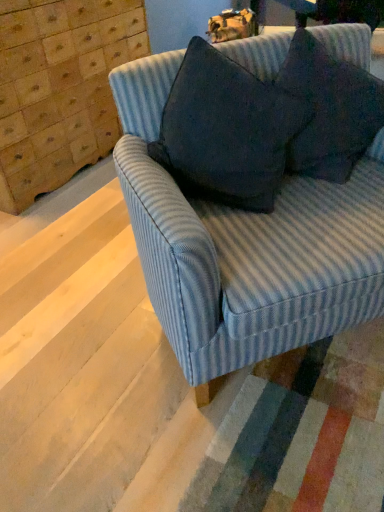
Question: Does dark fabric pillow at upper right, which is counted as the 1th throw pillow, starting from the right, have a lesser height compared to dark gray fabric pillow at upper right, arranged as the second throw pillow when viewed from the right?

Choices:
 (A) yes
 (B) no

Answer: (A)

Question: Does dark fabric pillow at upper right, which is counted as the second throw pillow, starting from the left, have a lesser width compared to dark gray fabric pillow at upper right, arranged as the second throw pillow when viewed from the right?

Choices:
 (A) no
 (B) yes

Answer: (B)

Question: Is dark fabric pillow at upper right, which is counted as the 1th throw pillow, starting from the right, facing away from dark gray fabric pillow at upper right, the first throw pillow when ordered from left to right?

Choices:
 (A) yes
 (B) no

Answer: (B)

Question: From the image's perspective, would you say dark fabric pillow at upper right, which is counted as the 1th throw pillow, starting from the right, is positioned over dark gray fabric pillow at upper right, the first throw pillow when ordered from left to right?

Choices:
 (A) no
 (B) yes

Answer: (B)

Question: Is dark fabric pillow at upper right, which is counted as the 1th throw pillow, starting from the right, in contact with dark gray fabric pillow at upper right, arranged as the second throw pillow when viewed from the right?

Choices:
 (A) yes
 (B) no

Answer: (B)

Question: In the image, is blue striped fabric couch at center on the left side or the right side of wooden dresser at upper left?

Choices:
 (A) right
 (B) left

Answer: (A)

Question: Is blue striped fabric couch at center taller or shorter than wooden dresser at upper left?

Choices:
 (A) tall
 (B) short

Answer: (B)

Question: Does point (196, 337) appear closer or farther from the camera than point (11, 209)?

Choices:
 (A) farther
 (B) closer

Answer: (B)

Question: Is blue striped fabric couch at center inside or outside of wooden dresser at upper left?

Choices:
 (A) inside
 (B) outside

Answer: (B)

Question: Based on their positions, is wooden dresser at upper left located to the left or right of dark fabric pillow at upper right, which is counted as the 1th throw pillow, starting from the right?

Choices:
 (A) left
 (B) right

Answer: (A)

Question: Is wooden dresser at upper left in front of or behind dark fabric pillow at upper right, which is counted as the 1th throw pillow, starting from the right, in the image?

Choices:
 (A) front
 (B) behind

Answer: (B)

Question: From the image's perspective, relative to dark fabric pillow at upper right, which is counted as the 1th throw pillow, starting from the right, is wooden dresser at upper left above or below?

Choices:
 (A) below
 (B) above

Answer: (B)

Question: From a real-world perspective, relative to dark fabric pillow at upper right, which is counted as the second throw pillow, starting from the left, is wooden dresser at upper left vertically above or below?

Choices:
 (A) below
 (B) above

Answer: (A)

Question: From the image's perspective, relative to dark fabric pillow at upper right, which is counted as the 1th throw pillow, starting from the right, is dark gray fabric pillow at upper right, arranged as the second throw pillow when viewed from the right, above or below?

Choices:
 (A) above
 (B) below

Answer: (B)

Question: Is dark gray fabric pillow at upper right, arranged as the second throw pillow when viewed from the right, to the left or to the right of dark fabric pillow at upper right, which is counted as the second throw pillow, starting from the left, in the image?

Choices:
 (A) left
 (B) right

Answer: (A)